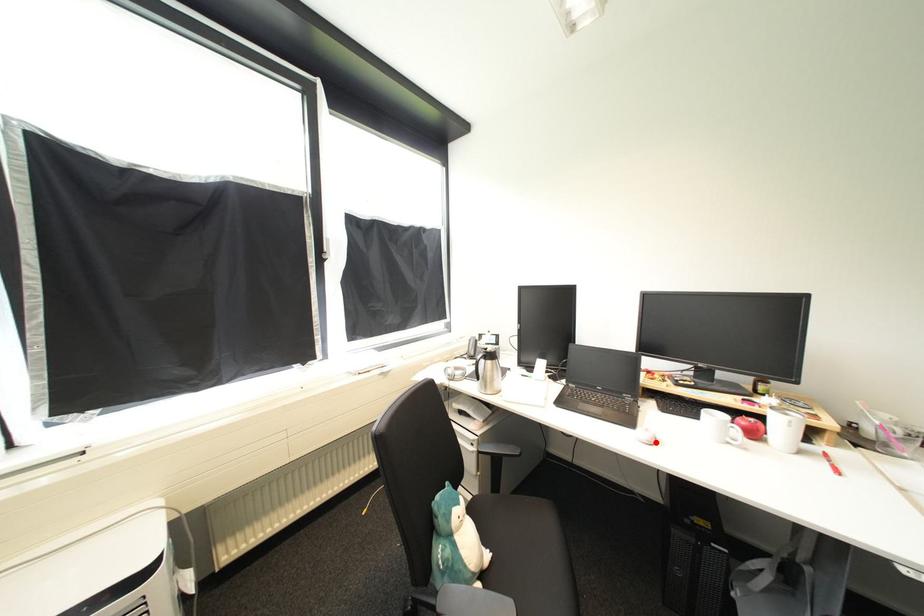
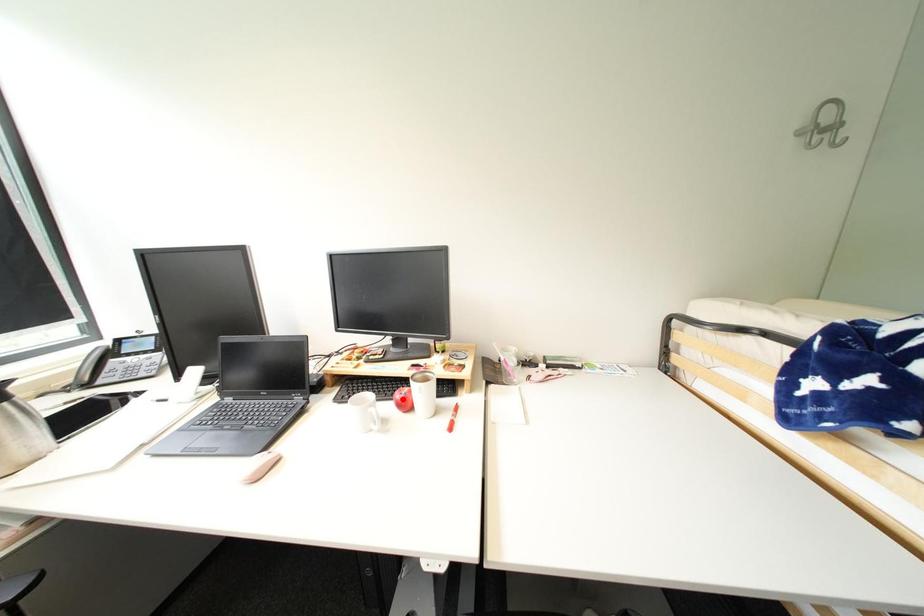
I am providing you with two images of the same scene from different viewpoints. A red point is marked on the first image and another point is marked on the second image. Does the point marked in image1 correspond to the same location as the one in image2?

No